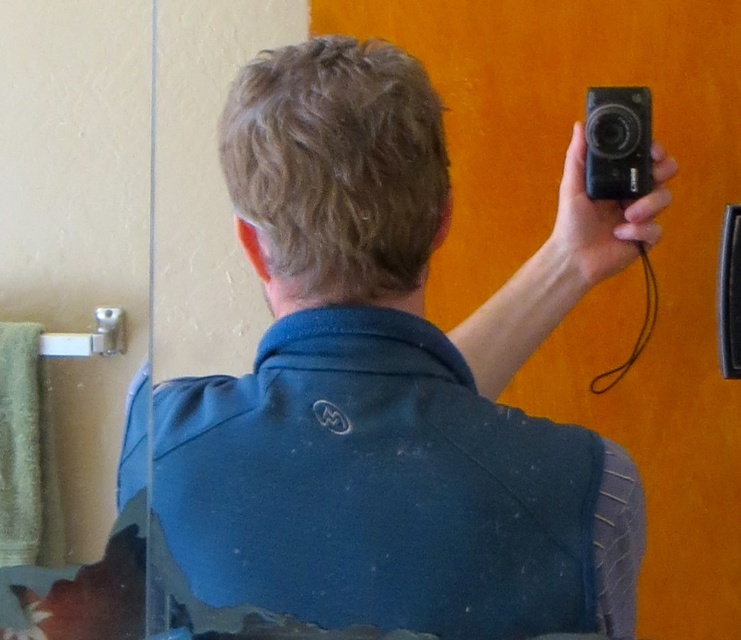
What is the exact coordinate of the blue fabric shirt at upper center?

The blue fabric shirt at upper center is located at coordinate point (x=392, y=381).

You are trying to frame a photo of the blue fabric shirt at upper center and the black plastic camera at upper right in the mirror. Which object should you position closer to the center of the mirror to ensure both fit within the frame?

The blue fabric shirt at upper center is wider than the black plastic camera at upper right, so you should position the blue fabric shirt at upper center closer to the center of the mirror to ensure both fit within the frame.